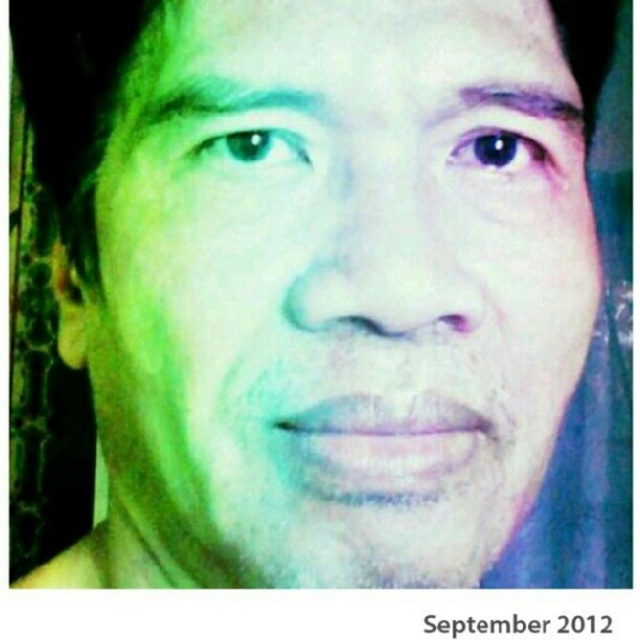
Is green matte face at center positioned at the back of green matte eye at upper left?

That is False.

Is green matte face at center wider than green matte eye at upper left?

Correct, the width of green matte face at center exceeds that of green matte eye at upper left.

Locate an element on the screen. Image resolution: width=640 pixels, height=640 pixels. green matte face at center is located at coordinates (348, 294).

Is green matte face at center below green matte eyebrow at upper center?

Correct, green matte face at center is located below green matte eyebrow at upper center.

Is green matte face at center shorter than green matte eyebrow at upper center?

Incorrect, green matte face at center's height does not fall short of green matte eyebrow at upper center's.

This screenshot has height=640, width=640. I want to click on green matte face at center, so click(348, 294).

Is green matte face at center behind purple matte eyebrow at upper center?

No, it is not.

Image resolution: width=640 pixels, height=640 pixels. Identify the location of green matte face at center. (348, 294).